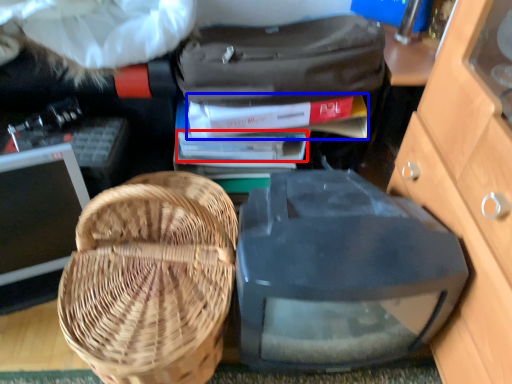
Question: Which object appears closest to the camera in this image, book (highlighted by a red box) or book (highlighted by a blue box)?

Choices:
 (A) book
 (B) book

Answer: (B)